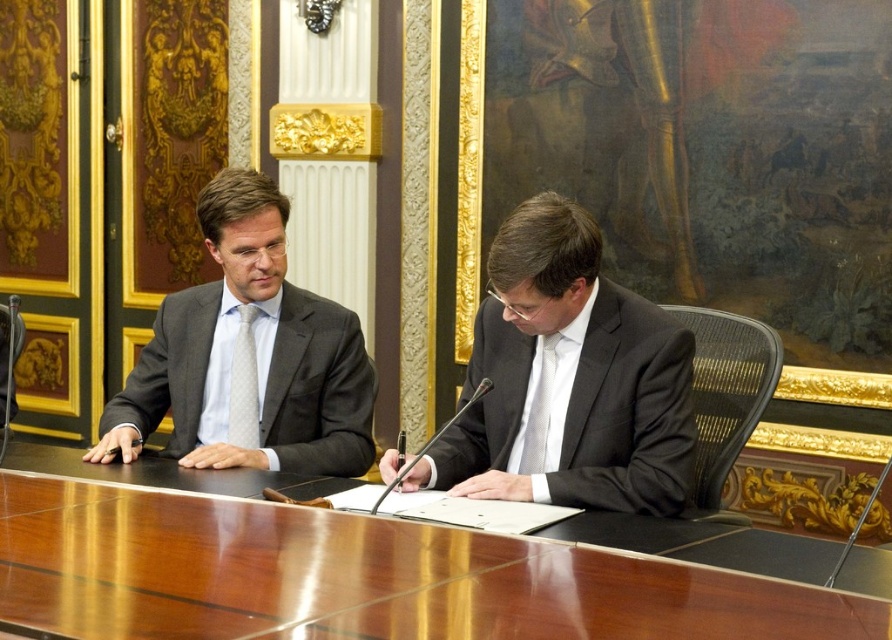
Question: Can you confirm if matte black suit at center is wider than white silk tie at center?

Choices:
 (A) no
 (B) yes

Answer: (B)

Question: Estimate the real-world distances between objects in this image. Which object is closer to the white silk tie at center?

Choices:
 (A) glossy wood table at center
 (B) white dotted tie at left

Answer: (A)

Question: Which object is positioned farthest from the matte gray suit at left?

Choices:
 (A) white dotted tie at left
 (B) glossy wood table at center

Answer: (B)

Question: Which object appears closest to the camera in this image?

Choices:
 (A) matte black suit at center
 (B) glossy wood table at center

Answer: (B)

Question: Where is glossy wood table at center located in relation to matte black suit at center in the image?

Choices:
 (A) left
 (B) right

Answer: (A)

Question: Is glossy wood table at center further to the viewer compared to matte gray suit at left?

Choices:
 (A) yes
 (B) no

Answer: (B)